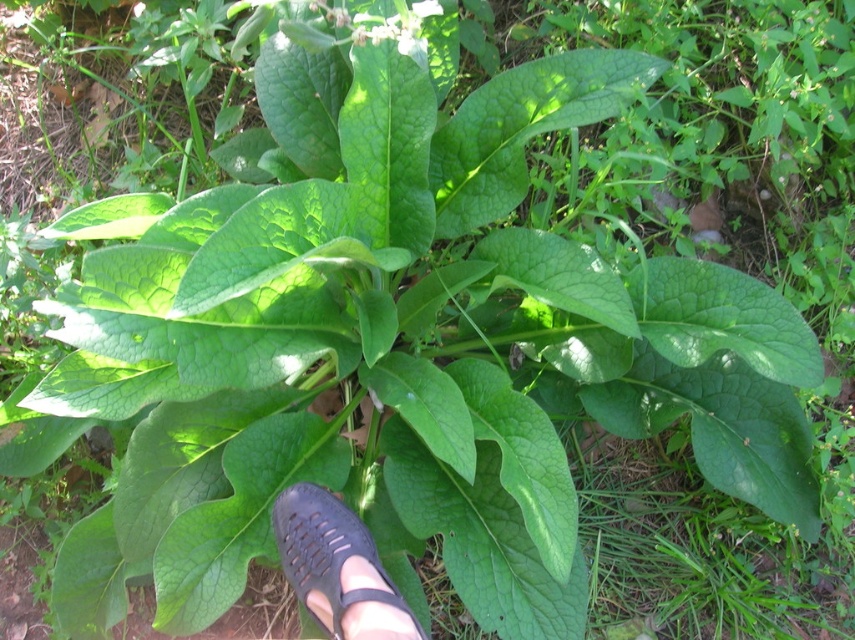
Can you confirm if black mesh shoe at center is positioned to the right of green matte flower at upper center?

Incorrect, black mesh shoe at center is not on the right side of green matte flower at upper center.

Based on the photo, does black mesh shoe at center have a greater height compared to green matte flower at upper center?

Yes, black mesh shoe at center is taller than green matte flower at upper center.

Who is more distant from viewer, (343, 508) or (392, 19)?

The point (343, 508) is more distant.

This screenshot has height=640, width=855. What are the coordinates of `black mesh shoe at center` in the screenshot? It's located at (337, 566).